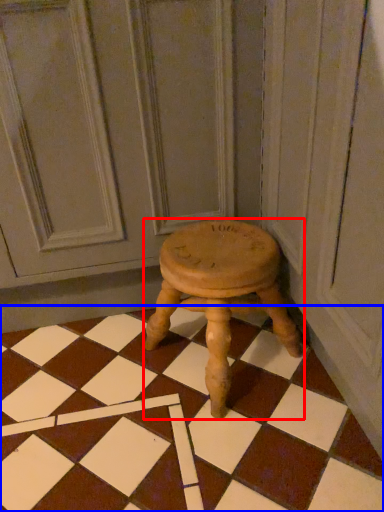
Question: Among these objects, which one is farthest to the camera, stool (highlighted by a red box) or square (highlighted by a blue box)?

Choices:
 (A) stool
 (B) square

Answer: (A)